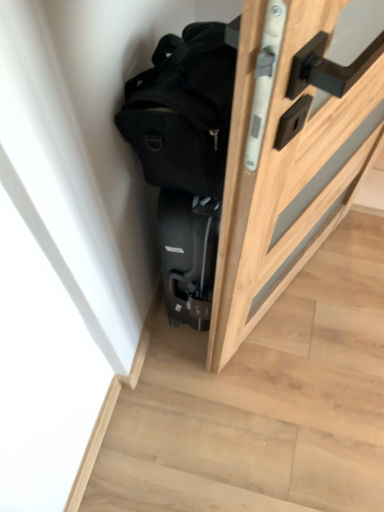
I want to click on free space in front of wooden door at right, so click(285, 400).